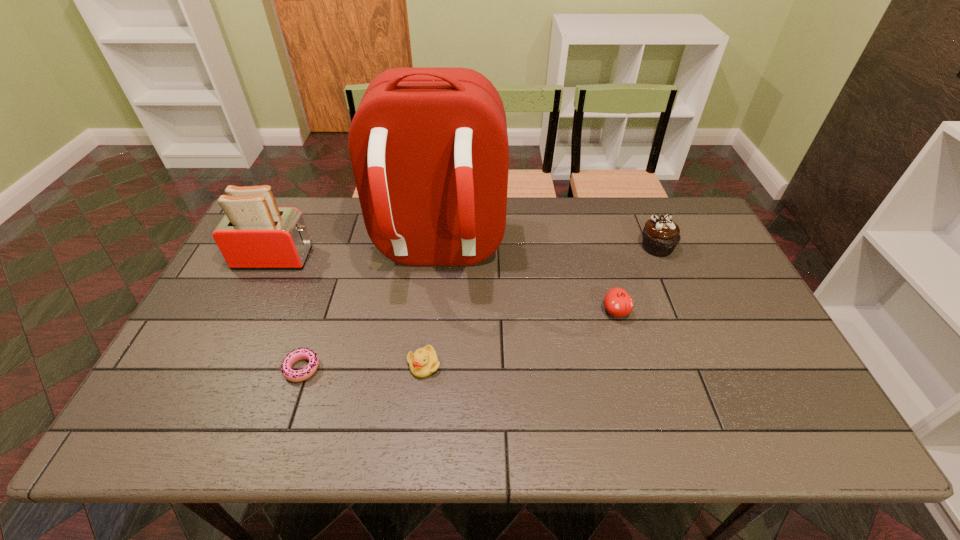
The image size is (960, 540). I want to click on vacant space that's between the cupcake and the duckling, so click(x=540, y=306).

Find the location of a particular element. The image size is (960, 540). vacant region between the cupcake and the doughnut is located at coordinates [479, 308].

Find the location of a particular element. This screenshot has width=960, height=540. vacant space in between the fifth object from right to left and the fifth object from left to right is located at coordinates (459, 340).

The width and height of the screenshot is (960, 540). Find the location of `free spot between the tallest object and the rightmost object`. free spot between the tallest object and the rightmost object is located at coordinates (547, 250).

This screenshot has height=540, width=960. What are the coordinates of `unoccupied position between the tallest object and the second object from right to left` in the screenshot? It's located at coord(526,282).

This screenshot has width=960, height=540. I want to click on object that can be found as the third closest to the fourth shortest object, so click(x=423, y=362).

Locate an element on the screen. The image size is (960, 540). object that is the closest to the doughnut is located at coordinates (428, 146).

The image size is (960, 540). In order to click on vacant area that satisfies the following two spatial constraints: 1. on the strap side of the tallest object; 2. on the right side of the apple in this screenshot , I will do `click(430, 312)`.

This screenshot has width=960, height=540. Find the location of `vacant space that satisfies the following two spatial constraints: 1. on the strap side of the backpack; 2. on the front-facing side of the toaster`. vacant space that satisfies the following two spatial constraints: 1. on the strap side of the backpack; 2. on the front-facing side of the toaster is located at coordinates (x=436, y=258).

This screenshot has width=960, height=540. I want to click on free space that satisfies the following two spatial constraints: 1. on the strap side of the tallest object; 2. on the front-facing side of the leftmost object, so (436, 258).